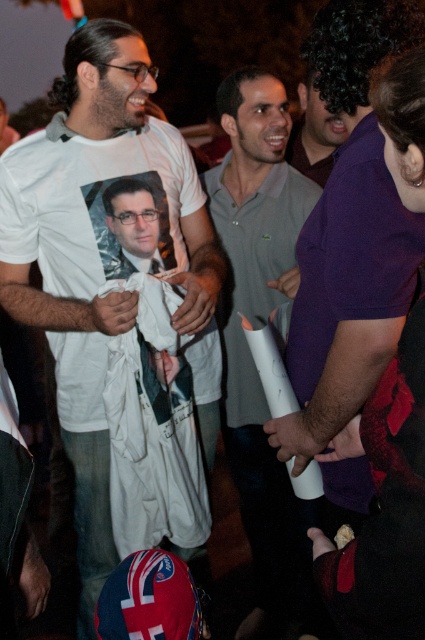
Who is positioned more to the left, white cotton t-shirt at center or gray cotton polo shirt at center?

white cotton t-shirt at center is more to the left.

Who is shorter, white cotton t-shirt at center or gray cotton polo shirt at center?

With less height is white cotton t-shirt at center.

Where is `white cotton t-shirt at center`? The image size is (425, 640). white cotton t-shirt at center is located at coordinates [x=105, y=257].